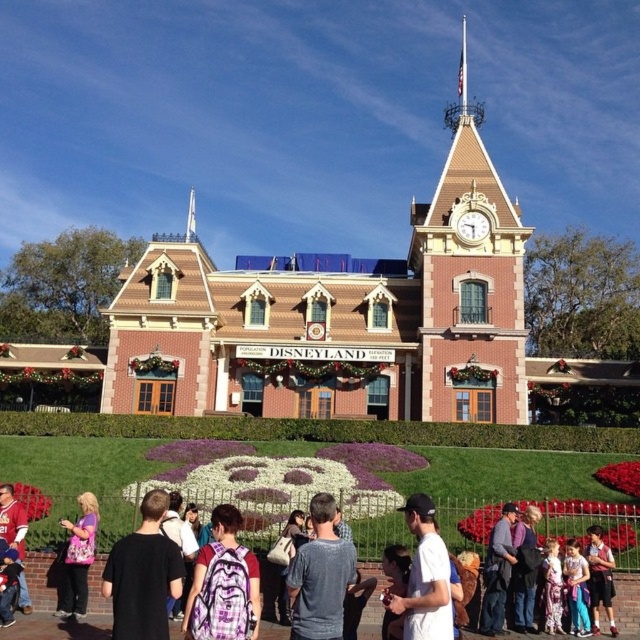
In the scene shown: You are a guest at Disneyland and see the purple plaid backpack at center and the matte red shirt at lower left. Which object is taller?

The purple plaid backpack at center is taller than the matte red shirt at lower left.

You are standing at the point marked as point (58, 596). You want to walk to the base of the Disneyland entrance clock tower. How far will you have to walk?

The distance between point (58, 596) and the base of the Disneyland entrance clock tower is 41.15 meters, so you will have to walk 41.15 meters.

You are a photographer standing in front of the Disneyland entrance. You want to take a photo that includes both the matte purple shirt at lower left and the gold metallic clock at upper center. Is there enough space between them to fit both in the frame?

The matte purple shirt at lower left and the gold metallic clock at upper center are 47.21 meters apart. Since this distance is quite large, you may need to use a wide angle lens or move closer to ensure both can fit in the frame.